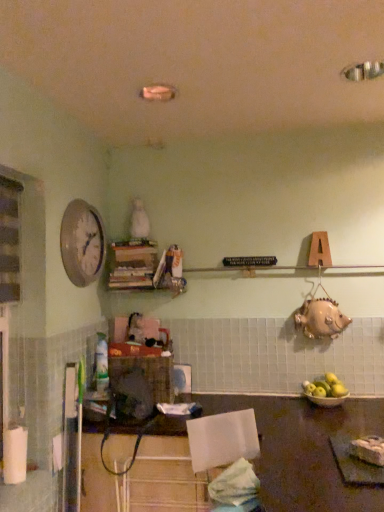
Question: Is wooden books at center bigger or smaller than yellow matte apple at lower right?

Choices:
 (A) small
 (B) big

Answer: (B)

Question: Is wooden books at center in front of or behind yellow matte apple at lower right in the image?

Choices:
 (A) front
 (B) behind

Answer: (B)

Question: Estimate the real-world distances between objects in this image. Which object is farther from the wooden table at lower center?

Choices:
 (A) yellow matte apple at lower right
 (B) wooden books at center
 (C) white glossy clock at upper left
 (D) white matte paper towel at lower left

Answer: (C)

Question: Which is farther from the yellow matte apple at lower right?

Choices:
 (A) white matte paper towel at lower left
 (B) wooden books at center
 (C) wooden table at lower center
 (D) white glossy clock at upper left

Answer: (A)